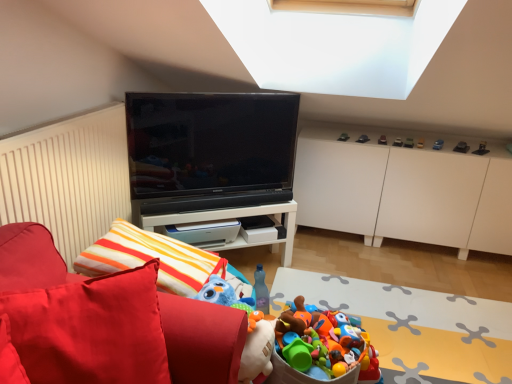
Find the location of `vacant space to the right of metallic car at upper right, the fifth toy viewed from the right`. vacant space to the right of metallic car at upper right, the fifth toy viewed from the right is located at coordinates (441, 144).